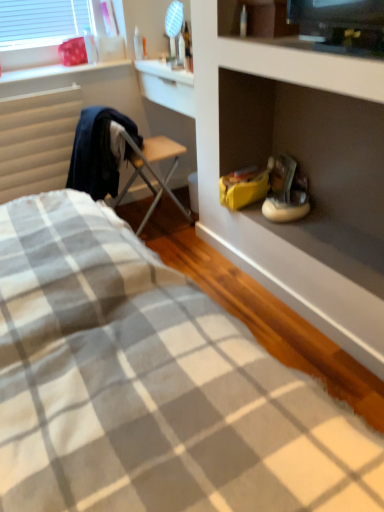
Where is `vacant space in matte white cabinet at upper right (from a real-world perspective)`? vacant space in matte white cabinet at upper right (from a real-world perspective) is located at coordinates (326, 239).